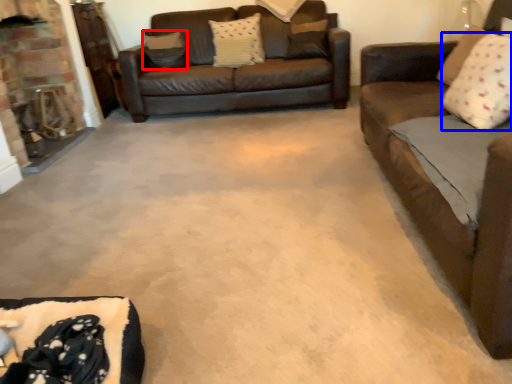
Question: Which point is further to the camera, pillow (highlighted by a red box) or pillow (highlighted by a blue box)?

Choices:
 (A) pillow
 (B) pillow

Answer: (A)